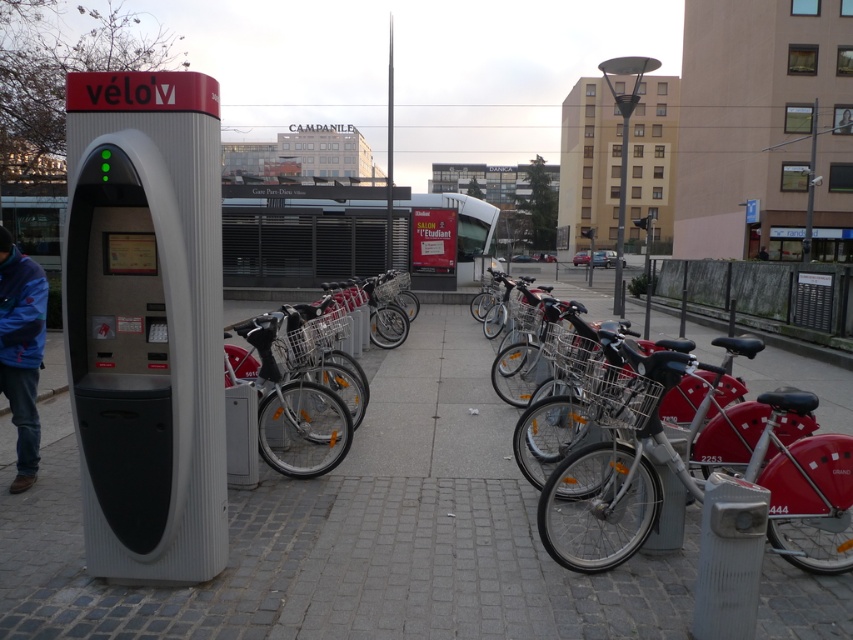
You are a delivery person who needs to choose between the metallic silver bicycle at center and the blue fleece jacket at lower left for your delivery route. Which item is more suitable for carrying packages?

The metallic silver bicycle at center is more suitable for carrying packages because it has a larger size compared to the blue fleece jacket at lower left, making it better for transporting items.

You are a cyclist who wants to rent a bike. You see a metallic silver bicycle at center and a matte red bicycle at center. Which one is closer to you?

The metallic silver bicycle at center is closer to you because it is in front of the matte red bicycle at center.

You are standing at the point labeled point (544, 508) and want to walk to the kiosk labeled

The distance between you and the kiosk is 12.39 feet, so you can walk directly to the kiosk.